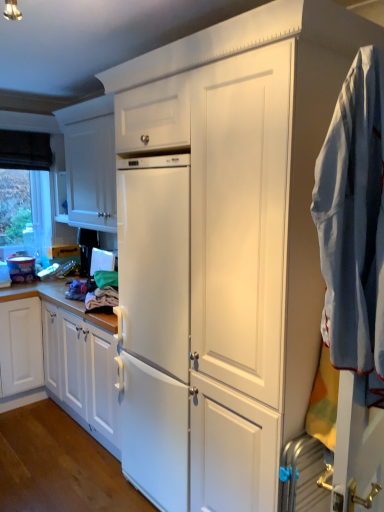
Question: Is transparent glass window at upper left a part of light blue cotton shirt at right?

Choices:
 (A) no
 (B) yes

Answer: (A)

Question: Is light blue cotton shirt at right placed right next to transparent glass window at upper left?

Choices:
 (A) yes
 (B) no

Answer: (B)

Question: Does light blue cotton shirt at right have a greater width compared to transparent glass window at upper left?

Choices:
 (A) no
 (B) yes

Answer: (B)

Question: Is light blue cotton shirt at right to the right of transparent glass window at upper left from the viewer's perspective?

Choices:
 (A) no
 (B) yes

Answer: (B)

Question: Would you say light blue cotton shirt at right is a long distance from transparent glass window at upper left?

Choices:
 (A) yes
 (B) no

Answer: (A)

Question: Relative to transparent glass window at upper left, is light blue cotton shirt at right in front or behind?

Choices:
 (A) front
 (B) behind

Answer: (A)

Question: Visually, is light blue cotton shirt at right positioned to the left or to the right of transparent glass window at upper left?

Choices:
 (A) left
 (B) right

Answer: (B)

Question: From the image's perspective, is light blue cotton shirt at right above or below transparent glass window at upper left?

Choices:
 (A) above
 (B) below

Answer: (B)

Question: Based on their sizes in the image, would you say light blue cotton shirt at right is bigger or smaller than transparent glass window at upper left?

Choices:
 (A) small
 (B) big

Answer: (B)

Question: Considering the positions of point (334, 304) and point (77, 183), is point (334, 304) closer or farther from the camera than point (77, 183)?

Choices:
 (A) farther
 (B) closer

Answer: (B)

Question: From the image's perspective, is light blue cotton shirt at right positioned above or below white matte cabinet at upper left?

Choices:
 (A) above
 (B) below

Answer: (B)

Question: Considering their positions, is light blue cotton shirt at right located in front of or behind white matte cabinet at upper left?

Choices:
 (A) behind
 (B) front

Answer: (B)

Question: Is light blue cotton shirt at right to the left or to the right of white matte cabinet at upper left in the image?

Choices:
 (A) right
 (B) left

Answer: (A)

Question: Looking at their shapes, would you say transparent glass window at upper left is wider or thinner than light blue cotton shirt at right?

Choices:
 (A) thin
 (B) wide

Answer: (A)

Question: Is transparent glass window at upper left to the left or to the right of light blue cotton shirt at right in the image?

Choices:
 (A) right
 (B) left

Answer: (B)